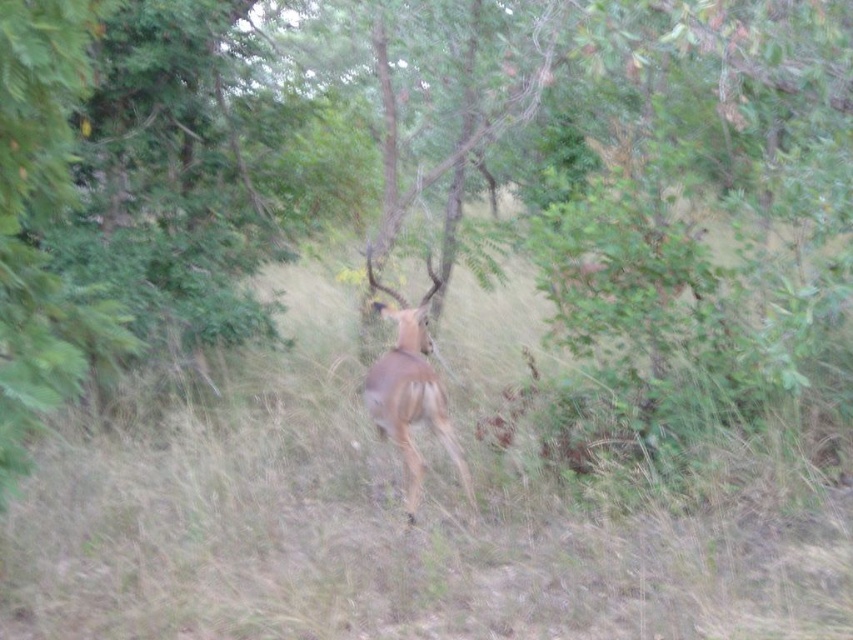
From the picture: How much distance is there between green grass at center and brown matte antelope at center?

1.04 meters

Based on the photo, between green grass at center and brown matte antelope at center, which one is positioned higher?

brown matte antelope at center is higher up.

Where is `green grass at center`? green grass at center is located at coordinates (416, 520).

The image size is (853, 640). Identify the location of green grass at center. (416, 520).